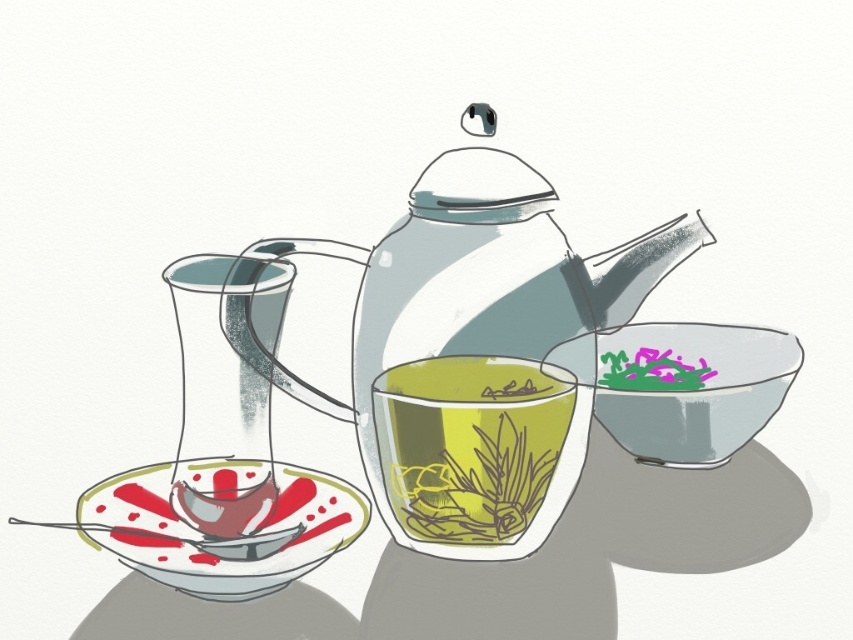
In the scene shown: You are setting up a tea service and have both the matte glass saucer at lower left and the transparent glass bowl at center right. Which object takes up more space?

The transparent glass bowl at center right occupies more space than the matte glass saucer at lower left.

You are holding a spoon and want to stir the tea in the transparent glass teacup at center. Since the matte glass saucer at lower left is underneath, will the saucer block your hand when stirring?

The transparent glass teacup at center is further to the viewer than the matte glass saucer at lower left, so the saucer is positioned behind the cup. This means the saucer will not block your hand while stirring the tea in the transparent glass teacup at center.